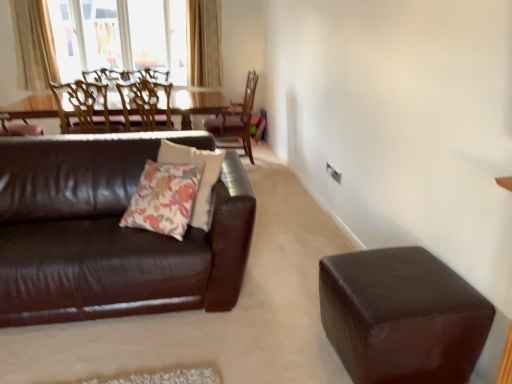
Question: From a real-world perspective, is beige fabric curtain at upper left, marked as the second curtain in a right-to-left arrangement, physically located above or below shiny brown leather couch at left?

Choices:
 (A) above
 (B) below

Answer: (A)

Question: Considering the relative positions of beige fabric curtain at upper left, marked as the second curtain in a right-to-left arrangement, and shiny brown leather couch at left in the image provided, is beige fabric curtain at upper left, marked as the second curtain in a right-to-left arrangement, to the left or to the right of shiny brown leather couch at left?

Choices:
 (A) right
 (B) left

Answer: (B)

Question: Which of these objects is positioned closest to the shiny brown leather stool at lower right?

Choices:
 (A) floral-patterned fabric pillow at center
 (B) light beige textured curtain at upper center, arranged as the second curtain when viewed from the left
 (C) wooden chair at center, which is the third chair in left-to-right order
 (D) wooden chair at upper left, acting as the third chair starting from the right
 (E) beige fabric curtain at upper left, the first curtain in the left-to-right sequence

Answer: (A)

Question: Which object is positioned farthest from the light beige textured curtain at upper center, arranged as the second curtain when viewed from the left?

Choices:
 (A) wooden chair at upper center, positioned as the 2th chair in right-to-left order
 (B) shiny brown leather stool at lower right
 (C) shiny brown leather couch at left
 (D) beige fabric curtain at upper left, the first curtain in the left-to-right sequence
 (E) floral-patterned fabric pillow at center

Answer: (B)